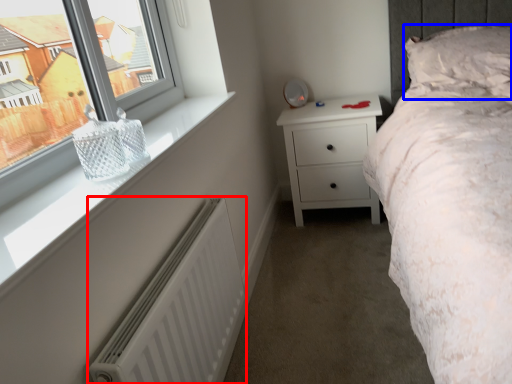
Question: Which of the following is the farthest to the observer, radiator (highlighted by a red box) or pillow (highlighted by a blue box)?

Choices:
 (A) radiator
 (B) pillow

Answer: (B)